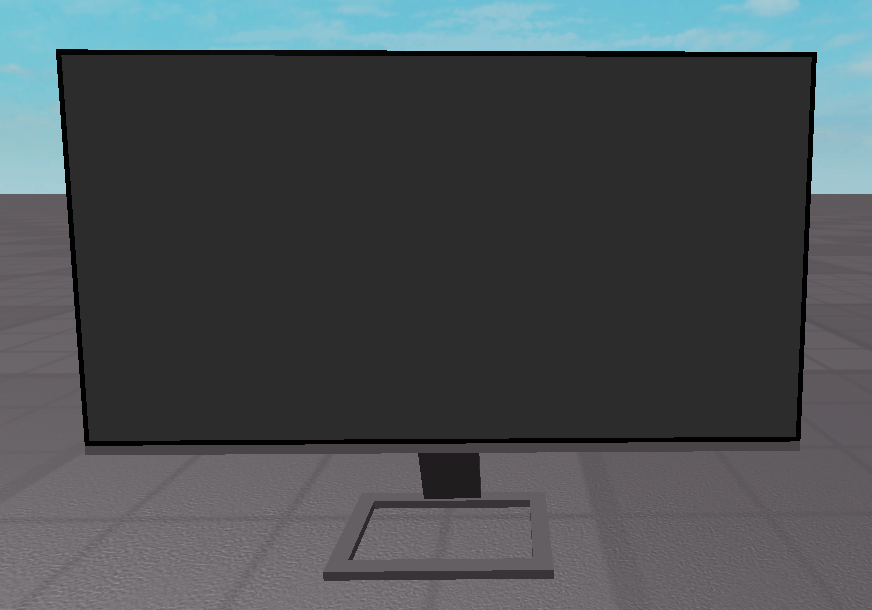
This screenshot has height=610, width=872. I want to click on stand, so click(454, 476).